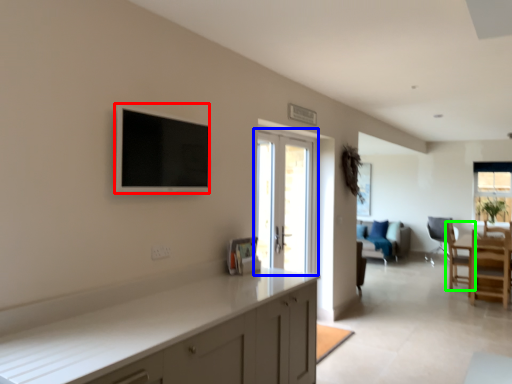
Question: Which is farther away from flat (highlighted by a red box)? door (highlighted by a blue box) or chair (highlighted by a green box)?

Choices:
 (A) door
 (B) chair

Answer: (B)